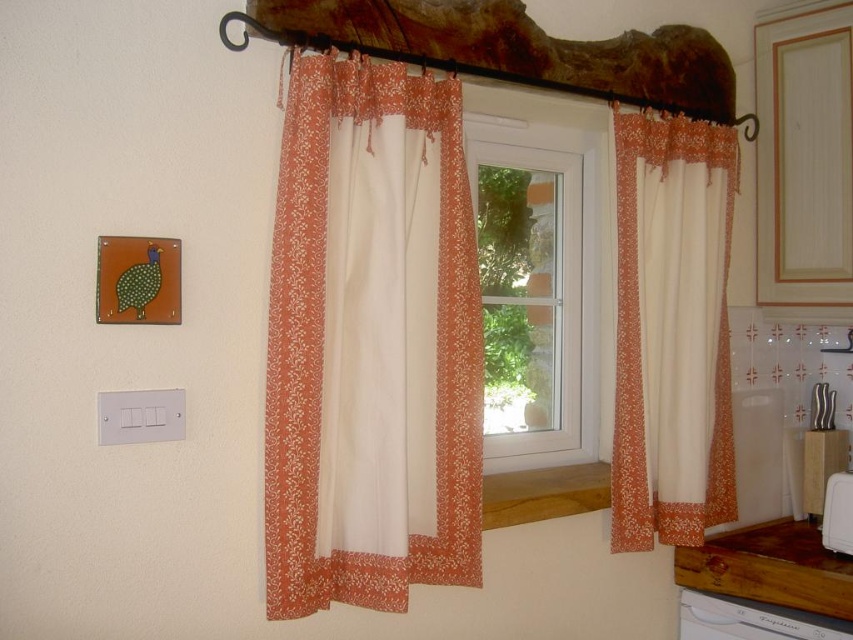
Is orange floral fabric curtains at center above floral lace curtain at right?

Incorrect, orange floral fabric curtains at center is not positioned above floral lace curtain at right.

Does orange floral fabric curtains at center appear on the left side of floral lace curtain at right?

Indeed, orange floral fabric curtains at center is positioned on the left side of floral lace curtain at right.

Does point (357, 552) come behind point (697, 124)?

No, (357, 552) is in front of (697, 124).

Image resolution: width=853 pixels, height=640 pixels. What are the coordinates of `orange floral fabric curtains at center` in the screenshot? It's located at (370, 342).

Consider the image. Which of these two, orange floral fabric curtains at center or white glossy refrigerator at lower right, stands shorter?

white glossy refrigerator at lower right

Is point (415, 301) behind point (830, 500)?

That is False.

The height and width of the screenshot is (640, 853). I want to click on orange floral fabric curtains at center, so tap(370, 342).

This screenshot has height=640, width=853. I want to click on orange floral fabric curtains at center, so coord(370,342).

Is orange floral fabric curtains at center in front of white plastic dishwasher at lower right?

Yes, orange floral fabric curtains at center is in front of white plastic dishwasher at lower right.

Can you confirm if orange floral fabric curtains at center is positioned to the left of white plastic dishwasher at lower right?

Indeed, orange floral fabric curtains at center is positioned on the left side of white plastic dishwasher at lower right.

Where is `orange floral fabric curtains at center`? This screenshot has height=640, width=853. orange floral fabric curtains at center is located at coordinates (370, 342).

The width and height of the screenshot is (853, 640). What are the coordinates of `orange floral fabric curtains at center` in the screenshot? It's located at (370, 342).